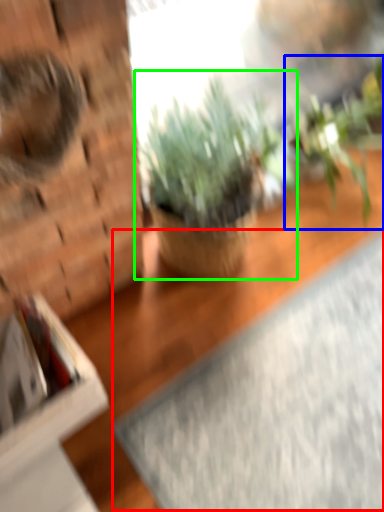
Question: Estimate the real-world distances between objects in this image. Which object is closer to yoga mat (highlighted by a red box), houseplant (highlighted by a blue box) or houseplant (highlighted by a green box)?

Choices:
 (A) houseplant
 (B) houseplant

Answer: (B)